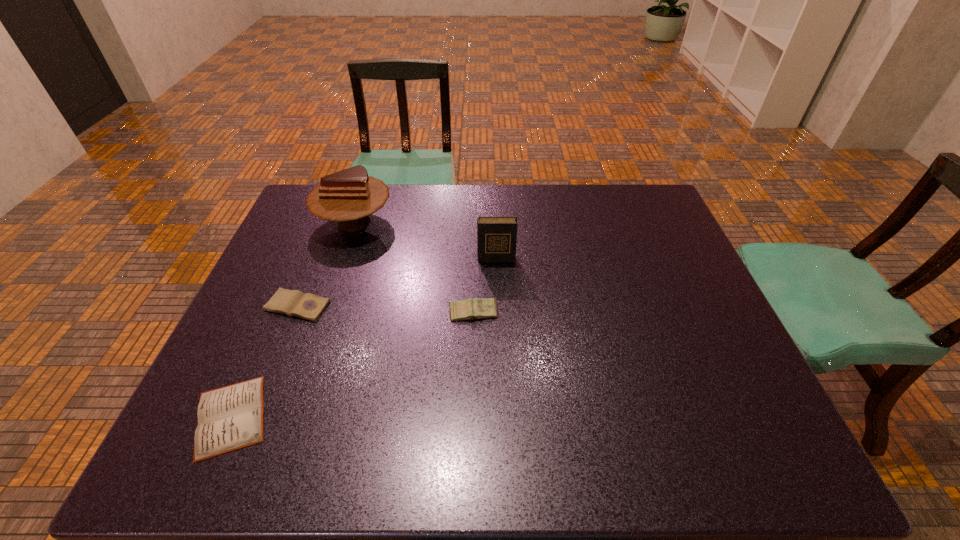
Identify which diary is located as the nearest to the nearest object. Please provide its 2D coordinates. Your answer should be formatted as a tuple, i.e. [(x, y)], where the tuple contains the x and y coordinates of a point satisfying the conditions above.

[(308, 306)]

Where is `vacant space that satisfies the following two spatial constraints: 1. on the front side of the cake; 2. on the right side of the second tallest diary`? vacant space that satisfies the following two spatial constraints: 1. on the front side of the cake; 2. on the right side of the second tallest diary is located at coordinates (324, 313).

The image size is (960, 540). I want to click on free space that satisfies the following two spatial constraints: 1. on the front side of the farthest object; 2. on the left side of the third shortest diary, so click(324, 313).